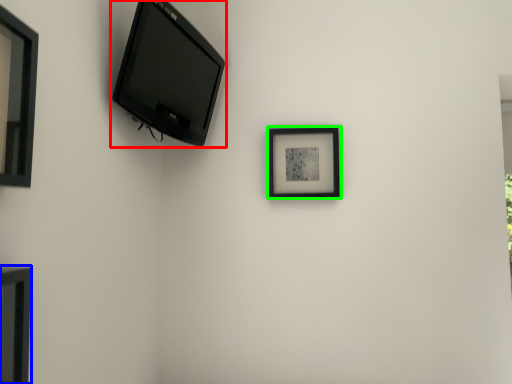
Question: Considering the real-world distances, which object is closest to television (highlighted by a red box)? picture frame (highlighted by a blue box) or picture frame (highlighted by a green box).

Choices:
 (A) picture frame
 (B) picture frame

Answer: (B)